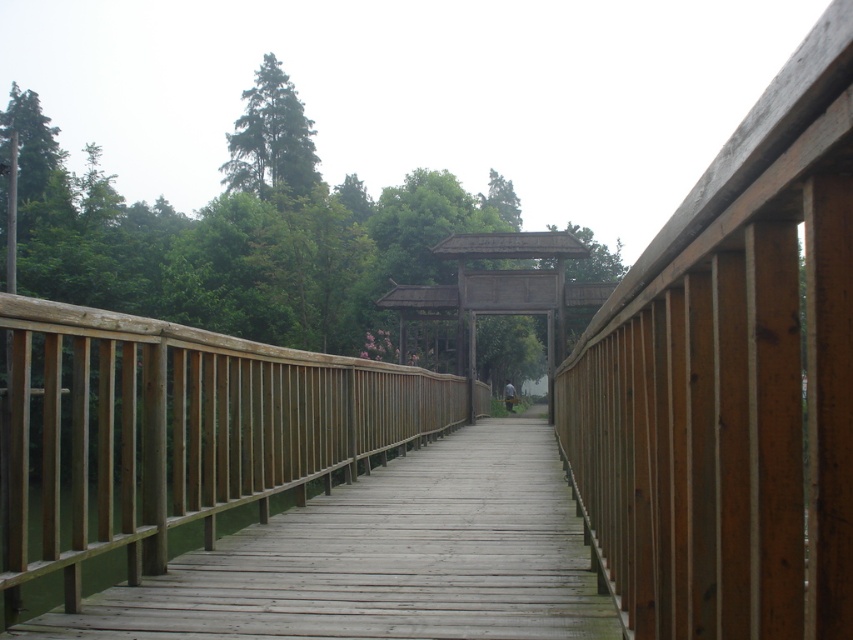
From the picture: You are standing on the wooden bridge and want to take a photo of both the point at coordinates (447, 481) and the point at coordinates (506, 252). Which point will appear larger in your camera view?

Point (447, 481) is closer to the camera than point (506, 252), so it will appear larger in the camera view.

You are standing on the wooden bridge and looking towards the traditional gate in the background. You see the wooden at center and the green matte tree at upper center. Which object is positioned to the right when viewed from your perspective?

The wooden at center is to the right of the green matte tree at upper center from your perspective.